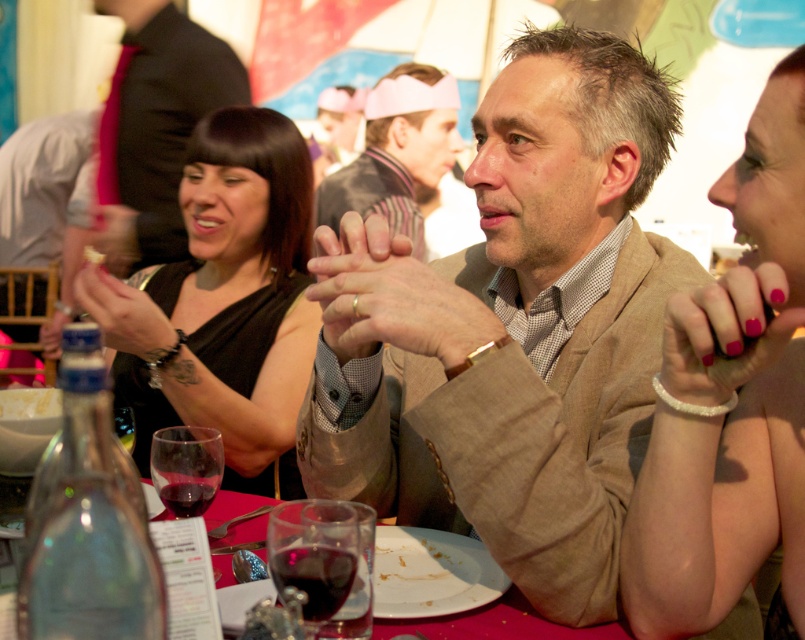
Which is in front, point (432, 292) or point (322, 621)?

Point (322, 621) is in front.

Does tan textured blazer at center have a lesser height compared to translucent glass wine at center?

No.

Where is `tan textured blazer at center`? This screenshot has width=805, height=640. tan textured blazer at center is located at coordinates (512, 332).

Does clear glass bottle at lower left have a lesser height compared to matte black shirt at center?

Yes.

Is clear glass bottle at lower left to the right of matte black shirt at center from the viewer's perspective?

Indeed, clear glass bottle at lower left is positioned on the right side of matte black shirt at center.

You are a GUI agent. You are given a task and a screenshot of the screen. Output one action in this format:
    pyautogui.click(x=<x>, y=<y>)
    Task: Click on the clear glass bottle at lower left
    The height and width of the screenshot is (640, 805).
    Given the screenshot: What is the action you would take?
    pyautogui.click(x=87, y=520)

Who is more distant from viewer, (391,170) or (186,428)?

The point (391,170) is more distant.

Between pink fabric headband at center and transparent glass at table center, which one is positioned higher?

Positioned higher is pink fabric headband at center.

Who is more forward, (x=384, y=188) or (x=219, y=458)?

Point (x=219, y=458) is in front.

Identify the location of pink fabric headband at center. (397, 152).